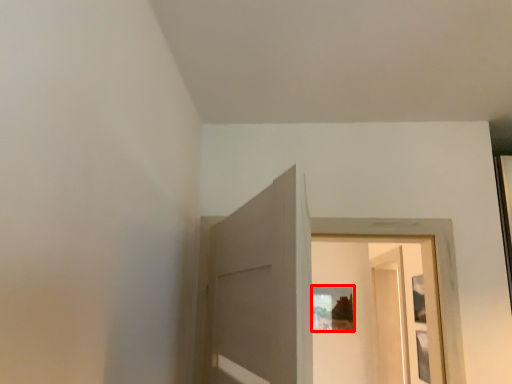
Question: From the image's perspective, considering the relative positions of picture frame (annotated by the red box) and screen door in the image provided, where is picture frame (annotated by the red box) located with respect to the staircase?

Choices:
 (A) above
 (B) below

Answer: (B)